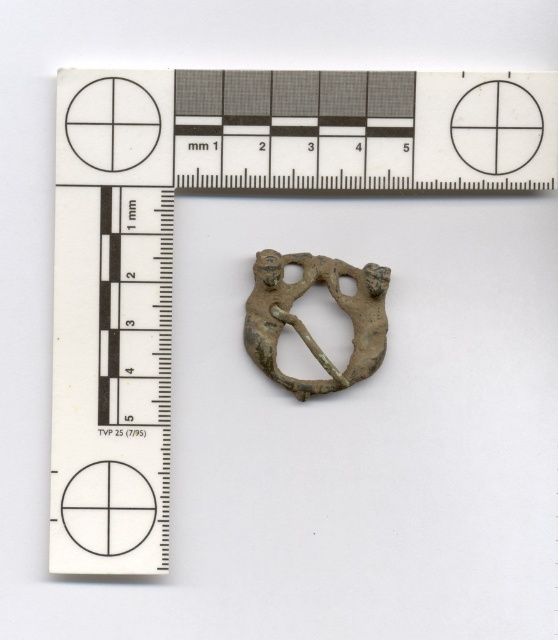
You are an archaeologist examining the artifact and notice a point marked at coordinates (x=218, y=188). What object in the scene corresponds to this point?

The metallic ruler at upper center is represented by point (x=218, y=188).

You are an archaeologist examining the artifact and need to document its features. Where exactly is the matte black circle at lower left located in relation to the ruler and grid?

The matte black circle at lower left is located at point (x=108, y=508) on the grid.